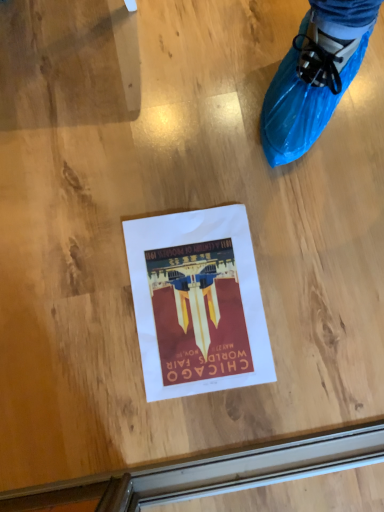
The width and height of the screenshot is (384, 512). I want to click on matte paper poster at center, so click(x=197, y=302).

This screenshot has width=384, height=512. Describe the element at coordinates (197, 302) in the screenshot. I see `matte paper poster at center` at that location.

Locate an element on the screen. The width and height of the screenshot is (384, 512). matte paper poster at center is located at coordinates (197, 302).